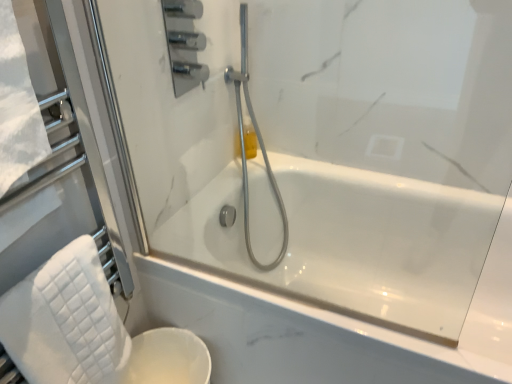
This screenshot has width=512, height=384. What do you see at coordinates (165, 359) in the screenshot? I see `white glossy toilet bowl at lower left` at bounding box center [165, 359].

The width and height of the screenshot is (512, 384). Describe the element at coordinates (250, 139) in the screenshot. I see `translucent yellow bottle at upper center` at that location.

The height and width of the screenshot is (384, 512). Identify the location of white glossy toilet bowl at lower left. (165, 359).

From a real-world perspective, is white glossy toilet bowl at lower left positioned under translucent yellow bottle at upper center based on gravity?

Yes, from a real-world perspective, white glossy toilet bowl at lower left is under translucent yellow bottle at upper center.

Which object is positioned more to the right, white glossy toilet bowl at lower left or translucent yellow bottle at upper center?

translucent yellow bottle at upper center.

Is point (170, 366) less distant than point (247, 155)?

Yes, point (170, 366) is closer to viewer.

From the image's perspective, would you say white glossy toilet bowl at lower left is positioned over translucent yellow bottle at upper center?

No.

Who is smaller, translucent yellow bottle at upper center or white glossy toilet bowl at lower left?

With smaller size is translucent yellow bottle at upper center.

Locate an element on the screen. toilet bowl on the left of the translucent yellow bottle at upper center is located at coordinates (165, 359).

Is white quilted towel at lower left turned away from translucent yellow bottle at upper center?

No, white quilted towel at lower left is not facing away from translucent yellow bottle at upper center.

From a real-world perspective, which object rests below the other?

From a 3D spatial view, white quilted towel at lower left is below.

How different are the orientations of white quilted towel at lower left and translucent yellow bottle at upper center in degrees?

The angular difference between white quilted towel at lower left and translucent yellow bottle at upper center is 89.3 degrees.

Considering the relative positions of white quilted towel at lower left and translucent yellow bottle at upper center in the image provided, is white quilted towel at lower left to the left or to the right of translucent yellow bottle at upper center?

Clearly, white quilted towel at lower left is on the left of translucent yellow bottle at upper center in the image.

From a real-world perspective, which is physically below, satin chrome shower head at center or white glossy toilet bowl at lower left?

white glossy toilet bowl at lower left.

Which is behind, point (247, 221) or point (205, 382)?

Positioned behind is point (247, 221).

From the image's perspective, relative to white glossy toilet bowl at lower left, is satin chrome shower head at center above or below?

Based on their image positions, satin chrome shower head at center is located above white glossy toilet bowl at lower left.

Locate an element on the screen. The image size is (512, 384). shower that appears above the white glossy toilet bowl at lower left (from the image's perspective) is located at coordinates (259, 144).

From the image's perspective, would you say white glossy toilet bowl at lower left is shown under white quilted towel at lower left?

Yes, from the image's perspective, white glossy toilet bowl at lower left is below white quilted towel at lower left.

Based on the photo, is white glossy toilet bowl at lower left facing away from white quilted towel at lower left?

white glossy toilet bowl at lower left does not have its back to white quilted towel at lower left.

Does white glossy toilet bowl at lower left touch white quilted towel at lower left?

No, white glossy toilet bowl at lower left is not in contact with white quilted towel at lower left.

Considering the relative positions of white glossy toilet bowl at lower left and white quilted towel at lower left in the image provided, is white glossy toilet bowl at lower left behind white quilted towel at lower left?

Yes, it is.

Which object is positioned more to the right, satin chrome shower head at center or translucent yellow bottle at upper center?

satin chrome shower head at center is more to the right.

How different are the orientations of satin chrome shower head at center and translucent yellow bottle at upper center in degrees?

satin chrome shower head at center and translucent yellow bottle at upper center are facing 89.1 degrees away from each other.

In terms of width, does satin chrome shower head at center look wider or thinner when compared to translucent yellow bottle at upper center?

In the image, satin chrome shower head at center appears to be wider than translucent yellow bottle at upper center.

From the image's perspective, between satin chrome shower head at center and translucent yellow bottle at upper center, which one is located above?

translucent yellow bottle at upper center.

How many degrees apart are the facing directions of translucent yellow bottle at upper center and satin chrome shower head at center?

The angular difference between translucent yellow bottle at upper center and satin chrome shower head at center is 89.1 degrees.

Does translucent yellow bottle at upper center come in front of satin chrome shower head at center?

No, it is behind satin chrome shower head at center.

How distant is translucent yellow bottle at upper center from satin chrome shower head at center?

They are 5.03 inches apart.

Is translucent yellow bottle at upper center looking in the opposite direction of satin chrome shower head at center?

No, translucent yellow bottle at upper center is not facing away from satin chrome shower head at center.

I want to click on toiletry above the white glossy toilet bowl at lower left (from the image's perspective), so click(250, 139).

Find the location of a particular element. This screenshot has width=512, height=384. toiletry that appears above the white glossy toilet bowl at lower left (from a real-world perspective) is located at coordinates point(250,139).

Considering their positions, is white quilted towel at lower left positioned further to translucent yellow bottle at upper center than white glossy toilet bowl at lower left?

white quilted towel at lower left.

Looking at the image, which one is located further to translucent yellow bottle at upper center, satin chrome shower head at center or white glossy toilet bowl at lower left?

white glossy toilet bowl at lower left.

When comparing their distances from white quilted towel at lower left, does white glossy toilet bowl at lower left or translucent yellow bottle at upper center seem closer?

white glossy toilet bowl at lower left is positioned closer to the anchor white quilted towel at lower left.

From the image, which object appears to be nearer to satin chrome shower head at center, white glossy toilet bowl at lower left or translucent yellow bottle at upper center?

Result: Among the two, translucent yellow bottle at upper center is located nearer to satin chrome shower head at center.

From the image, which object appears to be farther from white glossy toilet bowl at lower left, white quilted towel at lower left or translucent yellow bottle at upper center?

Among the two, translucent yellow bottle at upper center is located further to white glossy toilet bowl at lower left.

Looking at the image, which one is located further to white glossy toilet bowl at lower left, translucent yellow bottle at upper center or white quilted towel at lower left?

translucent yellow bottle at upper center is positioned further to the anchor white glossy toilet bowl at lower left.

When comparing their distances from satin chrome shower head at center, does translucent yellow bottle at upper center or white glossy toilet bowl at lower left seem closer?

Among the two, translucent yellow bottle at upper center is located nearer to satin chrome shower head at center.

When comparing their distances from white glossy toilet bowl at lower left, does satin chrome shower head at center or translucent yellow bottle at upper center seem closer?

satin chrome shower head at center is closer to white glossy toilet bowl at lower left.

Where is `shower that lies between translucent yellow bottle at upper center and white glossy toilet bowl at lower left from top to bottom`? This screenshot has width=512, height=384. shower that lies between translucent yellow bottle at upper center and white glossy toilet bowl at lower left from top to bottom is located at coordinates (259, 144).

Find the location of `toilet bowl between white quilted towel at lower left and translucent yellow bottle at upper center in the front-back direction`. toilet bowl between white quilted towel at lower left and translucent yellow bottle at upper center in the front-back direction is located at coordinates (165, 359).

At what (x,y) coordinates should I click in order to perform the action: click on bath towel between satin chrome shower head at center and white glossy toilet bowl at lower left from top to bottom. Please return your answer as a coordinate pair (x, y). Looking at the image, I should click on (65, 320).

Image resolution: width=512 pixels, height=384 pixels. I want to click on shower between white quilted towel at lower left and translucent yellow bottle at upper center from front to back, so [x=259, y=144].